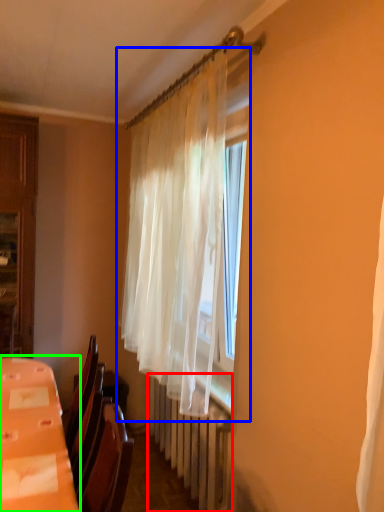
Question: Which object is positioned farthest from radiator (highlighted by a red box)? Select from curtain (highlighted by a blue box) and table (highlighted by a green box).

Choices:
 (A) curtain
 (B) table

Answer: (B)